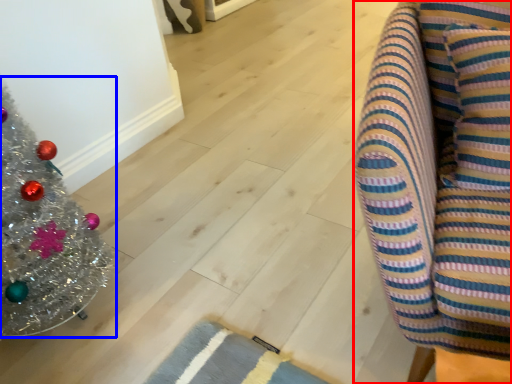
Question: Which object is further to the camera taking this photo, furniture (highlighted by a red box) or christmas tree (highlighted by a blue box)?

Choices:
 (A) furniture
 (B) christmas tree

Answer: (B)